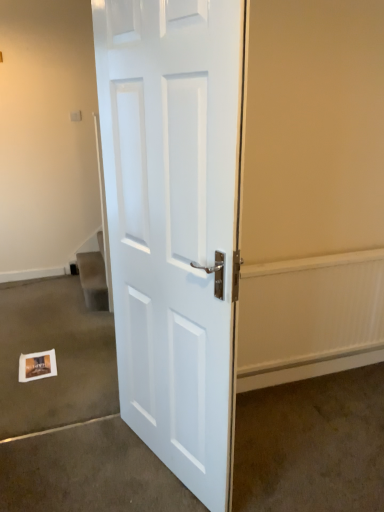
Question: Is white paper at lower left, the 1th concrete positioned from the left, closer to the viewer compared to white glossy door at center?

Choices:
 (A) yes
 (B) no

Answer: (B)

Question: Can you confirm if white paper at lower left, the 2th concrete viewed from the right, is positioned to the right of white glossy door at center?

Choices:
 (A) yes
 (B) no

Answer: (B)

Question: Considering the relative sizes of white paper at lower left, the 2th concrete viewed from the right, and white glossy door at center in the image provided, is white paper at lower left, the 2th concrete viewed from the right, shorter than white glossy door at center?

Choices:
 (A) no
 (B) yes

Answer: (B)

Question: From a real-world perspective, is white paper at lower left, the 1th concrete positioned from the left, over white glossy door at center?

Choices:
 (A) no
 (B) yes

Answer: (A)

Question: From a real-world perspective, is white paper at lower left, the 2th concrete viewed from the right, beneath white glossy door at center?

Choices:
 (A) no
 (B) yes

Answer: (B)

Question: Can you confirm if white paper at lower left, the 1th concrete positioned from the left, is taller than white glossy door at center?

Choices:
 (A) yes
 (B) no

Answer: (B)

Question: Is white glossy door at center facing towards matte white door at center, the 1th concrete viewed from the right?

Choices:
 (A) no
 (B) yes

Answer: (A)

Question: Is matte white door at center, the 1th concrete viewed from the right, inside white glossy door at center?

Choices:
 (A) no
 (B) yes

Answer: (A)

Question: Can you confirm if white glossy door at center is positioned to the right of matte white door at center, the 1th concrete viewed from the right?

Choices:
 (A) no
 (B) yes

Answer: (A)

Question: Is white glossy door at center shorter than matte white door at center, the 1th concrete viewed from the right?

Choices:
 (A) yes
 (B) no

Answer: (B)

Question: Is white glossy door at center located outside matte white door at center, the 1th concrete viewed from the right?

Choices:
 (A) yes
 (B) no

Answer: (A)

Question: From a real-world perspective, does white glossy door at center sit lower than matte white door at center, marked as the 2th concrete in a left-to-right arrangement?

Choices:
 (A) no
 (B) yes

Answer: (A)

Question: From the image's perspective, does white matte postcard at lower left appear lower than matte white door at center, the 1th concrete viewed from the right?

Choices:
 (A) yes
 (B) no

Answer: (B)